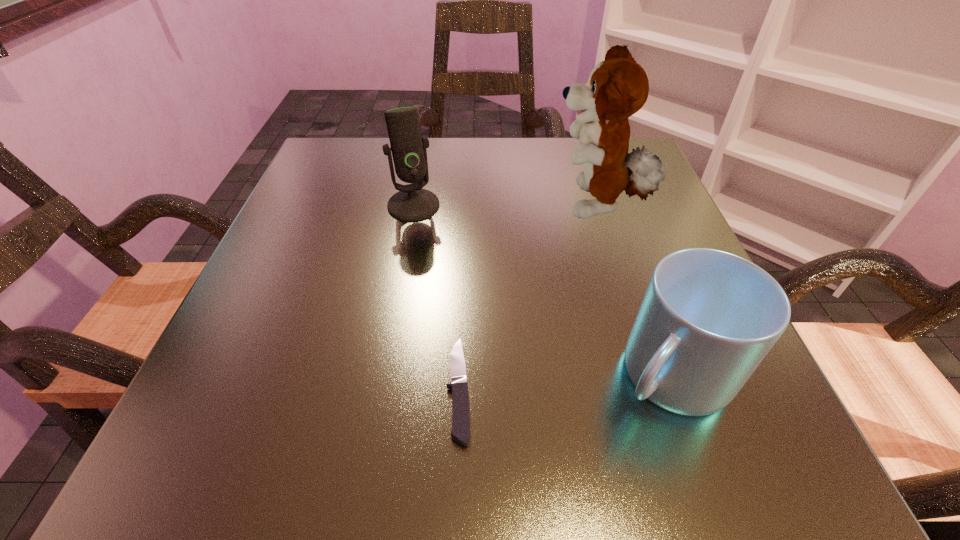
Locate an element on the screen. vacant space that is in between the mug and the puppy is located at coordinates (633, 291).

Find the location of `free space that is in between the shortest object and the leftmost object`. free space that is in between the shortest object and the leftmost object is located at coordinates (436, 297).

Where is `empty space that is in between the puppy and the third shortest object`? The height and width of the screenshot is (540, 960). empty space that is in between the puppy and the third shortest object is located at coordinates (505, 206).

You are a GUI agent. You are given a task and a screenshot of the screen. Output one action in this format:
    pyautogui.click(x=<x>, y=<y>)
    Task: Click on the vacant space that's between the tallest object and the leftmost object
    
    Given the screenshot: What is the action you would take?
    pyautogui.click(x=505, y=206)

Identify the location of free space between the steak knife and the leftmost object. The width and height of the screenshot is (960, 540). (436, 297).

Where is `unoccupied position between the third tallest object and the second object from left to right`? The image size is (960, 540). unoccupied position between the third tallest object and the second object from left to right is located at coordinates (564, 382).

Select which object appears as the third closest to the mug. Please provide its 2D coordinates. Your answer should be formatted as a tuple, i.e. [(x, y)], where the tuple contains the x and y coordinates of a point satisfying the conditions above.

[(412, 203)]

You are a GUI agent. You are given a task and a screenshot of the screen. Output one action in this format:
    pyautogui.click(x=<x>, y=<y>)
    Task: Click on the object that is the second nearest to the mug
    
    Given the screenshot: What is the action you would take?
    point(618,87)

This screenshot has height=540, width=960. Find the location of `free space that satisfies the following two spatial constraints: 1. on the face of the puppy; 2. on the back side of the mug`. free space that satisfies the following two spatial constraints: 1. on the face of the puppy; 2. on the back side of the mug is located at coordinates (649, 375).

Find the location of a particular element. The image size is (960, 540). vacant space that satisfies the following two spatial constraints: 1. on the back side of the mug; 2. on the face of the tallest object is located at coordinates (611, 207).